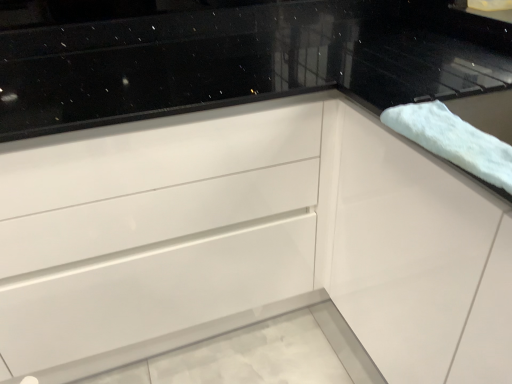
The width and height of the screenshot is (512, 384). Describe the element at coordinates (453, 140) in the screenshot. I see `white fluffy bath towel at upper right` at that location.

Locate an element on the screen. white fluffy bath towel at upper right is located at coordinates (453, 140).

I want to click on white fluffy bath towel at upper right, so click(x=453, y=140).